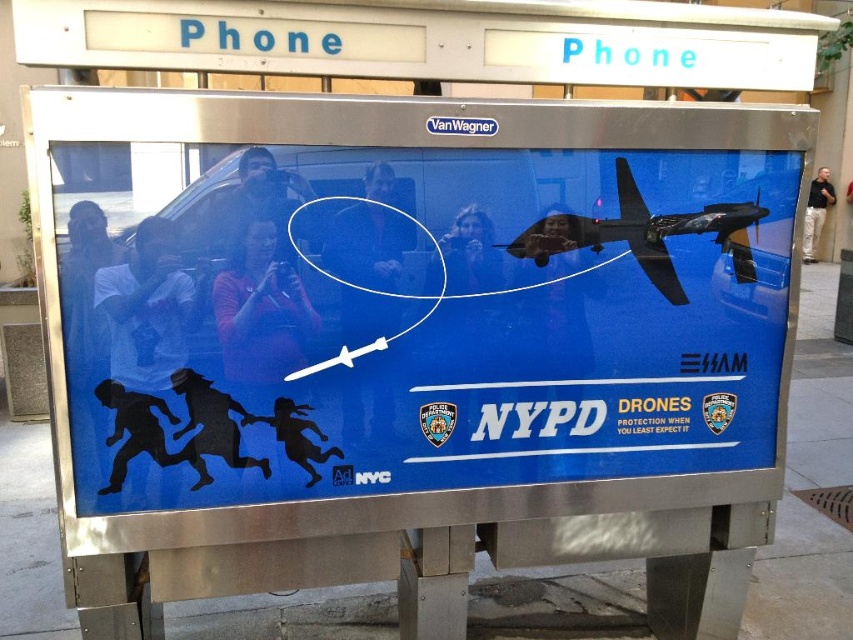
Question: Can you confirm if blue matte airplane at center is bigger than shiny black drone at upper right?

Choices:
 (A) yes
 (B) no

Answer: (A)

Question: Among these objects, which one is nearest to the camera?

Choices:
 (A) blue matte airplane at center
 (B) shiny black drone at upper right

Answer: (A)

Question: Which point is farther to the camera?

Choices:
 (A) blue matte airplane at center
 (B) shiny black drone at upper right

Answer: (B)

Question: Can you confirm if blue matte airplane at center is positioned above shiny black drone at upper right?

Choices:
 (A) yes
 (B) no

Answer: (B)

Question: Does blue matte airplane at center have a larger size compared to shiny black drone at upper right?

Choices:
 (A) no
 (B) yes

Answer: (B)